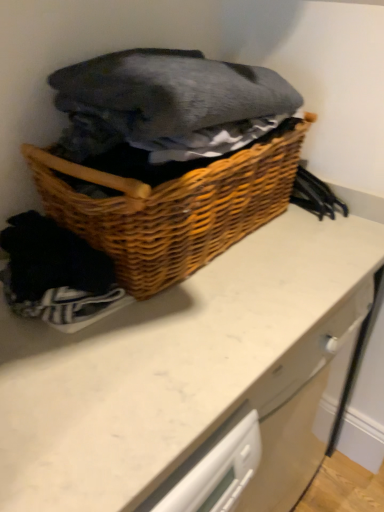
Question: Are white marble counter at center and dark gray cotton blanket at upper center located far from each other?

Choices:
 (A) no
 (B) yes

Answer: (A)

Question: Considering the relative positions of white marble counter at center and dark gray cotton blanket at upper center in the image provided, is white marble counter at center to the left of dark gray cotton blanket at upper center from the viewer's perspective?

Choices:
 (A) no
 (B) yes

Answer: (A)

Question: From the image's perspective, would you say white marble counter at center is positioned over dark gray cotton blanket at upper center?

Choices:
 (A) no
 (B) yes

Answer: (A)

Question: Does white marble counter at center turn towards dark gray cotton blanket at upper center?

Choices:
 (A) no
 (B) yes

Answer: (A)

Question: Can you confirm if white marble counter at center is taller than dark gray cotton blanket at upper center?

Choices:
 (A) no
 (B) yes

Answer: (B)

Question: Is white marble counter at center smaller than dark gray cotton blanket at upper center?

Choices:
 (A) no
 (B) yes

Answer: (A)

Question: From the image's perspective, is dark gray cotton blanket at upper center below white marble counter at center?

Choices:
 (A) yes
 (B) no

Answer: (B)

Question: Is dark gray cotton blanket at upper center oriented away from white marble counter at center?

Choices:
 (A) yes
 (B) no

Answer: (B)

Question: Is dark gray cotton blanket at upper center in contact with white marble counter at center?

Choices:
 (A) yes
 (B) no

Answer: (B)

Question: Can you confirm if dark gray cotton blanket at upper center is thinner than white marble counter at center?

Choices:
 (A) yes
 (B) no

Answer: (A)

Question: Is dark gray cotton blanket at upper center not near white marble counter at center?

Choices:
 (A) no
 (B) yes

Answer: (A)

Question: Does dark gray cotton blanket at upper center contain white marble counter at center?

Choices:
 (A) yes
 (B) no

Answer: (B)

Question: Is woven wood basket at center wider than white marble counter at center?

Choices:
 (A) yes
 (B) no

Answer: (B)